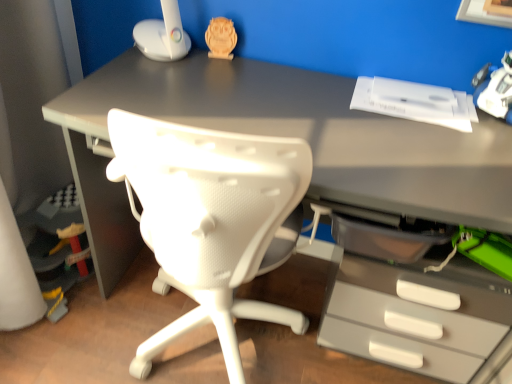
Describe the element at coordinates (495, 89) in the screenshot. The width and height of the screenshot is (512, 384). I see `white plastic toy at upper right, positioned as the 1th toy in bottom-to-top order` at that location.

Where is `white plastic toy at upper right, acting as the second toy starting from the left`? The height and width of the screenshot is (384, 512). white plastic toy at upper right, acting as the second toy starting from the left is located at coordinates (495, 89).

The image size is (512, 384). I want to click on wooden owl at upper center, which is the 1th toy from back to front, so click(x=221, y=38).

What do you see at coordinates (221, 38) in the screenshot? I see `wooden owl at upper center, positioned as the 2th toy in front-to-back order` at bounding box center [221, 38].

Where is `white plastic toy at upper right, acting as the second toy starting from the left`? white plastic toy at upper right, acting as the second toy starting from the left is located at coordinates (x=495, y=89).

Would you say wooden owl at upper center, positioned as the 2th toy in front-to-back order, is to the left or to the right of white plastic toy at upper right, the 1th toy when ordered from right to left, in the picture?

wooden owl at upper center, positioned as the 2th toy in front-to-back order, is positioned on white plastic toy at upper right, the 1th toy when ordered from right to left,'s left side.

Considering their positions, is wooden owl at upper center, which is the 1th toy from top to bottom, located in front of or behind white plastic toy at upper right, the 1th toy when ordered from right to left?

wooden owl at upper center, which is the 1th toy from top to bottom, is behind white plastic toy at upper right, the 1th toy when ordered from right to left.

Does point (227, 38) come farther from viewer compared to point (495, 109)?

Yes, point (227, 38) is farther from viewer.

From the image's perspective, which one is positioned lower, wooden owl at upper center, which is counted as the second toy, starting from the right, or white plastic toy at upper right, the 1th toy when ordered from front to back?

white plastic toy at upper right, the 1th toy when ordered from front to back.

From a real-world perspective, is wooden owl at upper center, which is the 1th toy from back to front, on top of white plastic toy at upper right, the 1th toy when ordered from right to left?

No, from a real-world perspective, wooden owl at upper center, which is the 1th toy from back to front, is not over white plastic toy at upper right, the 1th toy when ordered from right to left

In terms of width, does wooden owl at upper center, positioned as the 2th toy in front-to-back order, look wider or thinner when compared to white plastic toy at upper right, the 1th toy when ordered from front to back?

wooden owl at upper center, positioned as the 2th toy in front-to-back order, is thinner than white plastic toy at upper right, the 1th toy when ordered from front to back.

Which of these two, wooden owl at upper center, which is the 1th toy from top to bottom, or white plastic toy at upper right, the 1th toy when ordered from right to left, stands taller?

white plastic toy at upper right, the 1th toy when ordered from right to left, is taller.

Who is bigger, wooden owl at upper center, which is counted as the second toy, starting from the right, or white plastic toy at upper right, which is counted as the second toy, starting from the top?

With larger size is white plastic toy at upper right, which is counted as the second toy, starting from the top.

Is wooden owl at upper center, which is counted as the second toy, starting from the right, spatially inside white plastic toy at upper right, acting as the second toy starting from the left, or outside of it?

wooden owl at upper center, which is counted as the second toy, starting from the right, is not inside white plastic toy at upper right, acting as the second toy starting from the left, it's outside.

Are wooden owl at upper center, which is the 1th toy from back to front, and white plastic toy at upper right, positioned as the 1th toy in bottom-to-top order, making contact?

No.

Is wooden owl at upper center, which is the 1th toy from top to bottom, oriented away from white plastic toy at upper right, the second toy in the back-to-front sequence?

No, white plastic toy at upper right, the second toy in the back-to-front sequence, is not at the back of wooden owl at upper center, which is the 1th toy from top to bottom.

How many degrees apart are the facing directions of wooden owl at upper center, marked as the second toy in a bottom-to-top arrangement, and white plastic toy at upper right, positioned as the 1th toy in bottom-to-top order?

They differ by 57.5 degrees in their facing directions.

At what (x,y) coordinates should I click in order to perform the action: click on toy in front of the wooden owl at upper center, positioned as the 2th toy in front-to-back order. Please return your answer as a coordinate pair (x, y). This screenshot has width=512, height=384. Looking at the image, I should click on (495, 89).

Can you confirm if white plastic toy at upper right, positioned as the 1th toy in bottom-to-top order, is positioned to the right of wooden owl at upper center, which is the 1th toy from back to front?

Indeed, white plastic toy at upper right, positioned as the 1th toy in bottom-to-top order, is positioned on the right side of wooden owl at upper center, which is the 1th toy from back to front.

Considering their positions, is white plastic toy at upper right, the 1th toy when ordered from right to left, located in front of or behind wooden owl at upper center, marked as the second toy in a bottom-to-top arrangement?

In the image, white plastic toy at upper right, the 1th toy when ordered from right to left, appears in front of wooden owl at upper center, marked as the second toy in a bottom-to-top arrangement.

Is point (506, 108) behind point (227, 48)?

No, (506, 108) is in front of (227, 48).

From the image's perspective, is white plastic toy at upper right, the second toy in the back-to-front sequence, on top of wooden owl at upper center, marked as the second toy in a bottom-to-top arrangement?

No, from the image's perspective, white plastic toy at upper right, the second toy in the back-to-front sequence, is not on top of wooden owl at upper center, marked as the second toy in a bottom-to-top arrangement.

From a real-world perspective, relative to wooden owl at upper center, positioned as the 2th toy in front-to-back order, is white plastic toy at upper right, the 1th toy when ordered from right to left, vertically above or below?

Clearly, from a real-world perspective, white plastic toy at upper right, the 1th toy when ordered from right to left, is above wooden owl at upper center, positioned as the 2th toy in front-to-back order.

Does white plastic toy at upper right, which is counted as the second toy, starting from the top, have a lesser width compared to wooden owl at upper center, which is the 1th toy from top to bottom?

Incorrect, the width of white plastic toy at upper right, which is counted as the second toy, starting from the top, is not less than that of wooden owl at upper center, which is the 1th toy from top to bottom.

Who is shorter, white plastic toy at upper right, the second toy in the back-to-front sequence, or wooden owl at upper center, which is counted as the second toy, starting from the right?

wooden owl at upper center, which is counted as the second toy, starting from the right.

Based on their sizes in the image, would you say white plastic toy at upper right, the 1th toy when ordered from right to left, is bigger or smaller than wooden owl at upper center, which is counted as the second toy, starting from the right?

In the image, white plastic toy at upper right, the 1th toy when ordered from right to left, appears to be larger than wooden owl at upper center, which is counted as the second toy, starting from the right.

Is white plastic toy at upper right, which is counted as the second toy, starting from the top, surrounding wooden owl at upper center, which is counted as the second toy, starting from the right?

No, wooden owl at upper center, which is counted as the second toy, starting from the right, is not surrounded by white plastic toy at upper right, which is counted as the second toy, starting from the top.

Is white plastic toy at upper right, the 1th toy when ordered from right to left, in contact with wooden owl at upper center, which is counted as the second toy, starting from the right?

white plastic toy at upper right, the 1th toy when ordered from right to left, and wooden owl at upper center, which is counted as the second toy, starting from the right, are not in contact.

Consider the image. Could you tell me if white plastic toy at upper right, which is counted as the second toy, starting from the top, is turned towards wooden owl at upper center, marked as the second toy in a bottom-to-top arrangement?

No, white plastic toy at upper right, which is counted as the second toy, starting from the top, does not turn towards wooden owl at upper center, marked as the second toy in a bottom-to-top arrangement.

What's the angular difference between white plastic toy at upper right, the 1th toy when ordered from front to back, and wooden owl at upper center, positioned as the 1th toy in left-to-right order,'s facing directions?

The facing directions of white plastic toy at upper right, the 1th toy when ordered from front to back, and wooden owl at upper center, positioned as the 1th toy in left-to-right order, are 57.5 degrees apart.

How much distance is there between white plastic toy at upper right, positioned as the 1th toy in bottom-to-top order, and wooden owl at upper center, which is the 1th toy from top to bottom?

white plastic toy at upper right, positioned as the 1th toy in bottom-to-top order, and wooden owl at upper center, which is the 1th toy from top to bottom, are 27.88 inches apart from each other.

I want to click on toy below the wooden owl at upper center, which is the 1th toy from back to front (from the image's perspective), so click(495, 89).

At what (x,y) coordinates should I click in order to perform the action: click on toy in front of the wooden owl at upper center, marked as the second toy in a bottom-to-top arrangement. Please return your answer as a coordinate pair (x, y). This screenshot has width=512, height=384. Looking at the image, I should click on (495, 89).

Identify the location of toy on the left of white plastic toy at upper right, which is counted as the second toy, starting from the top. Image resolution: width=512 pixels, height=384 pixels. (221, 38).